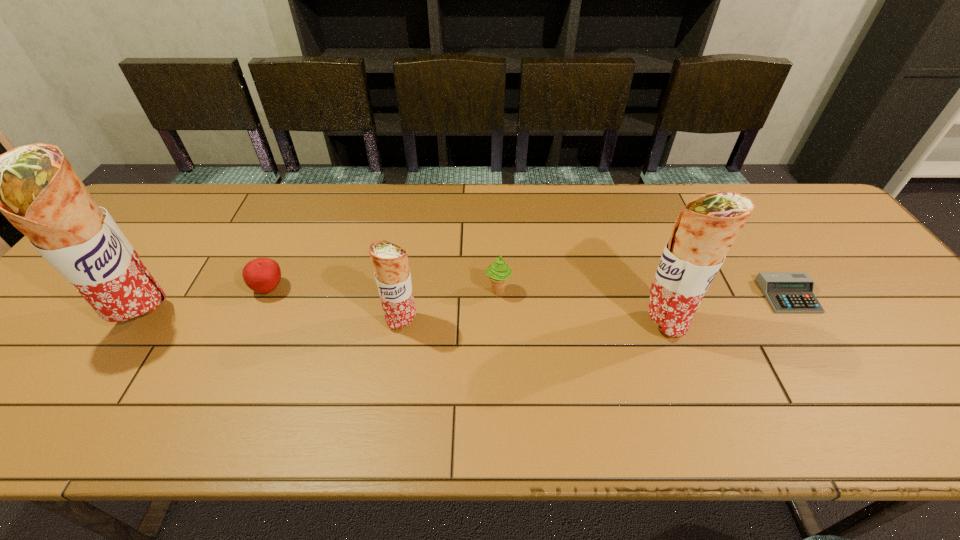
Identify which burrito is the closest to the fourth object from left to right. Please provide its 2D coordinates. Your answer should be formatted as a tuple, i.e. [(x, y)], where the tuple contains the x and y coordinates of a point satisfying the conditions above.

[(390, 261)]

The width and height of the screenshot is (960, 540). What are the coordinates of `free space in the image that satisfies the following two spatial constraints: 1. on the back side of the shortest object; 2. on the left side of the leftmost object` in the screenshot? It's located at (159, 296).